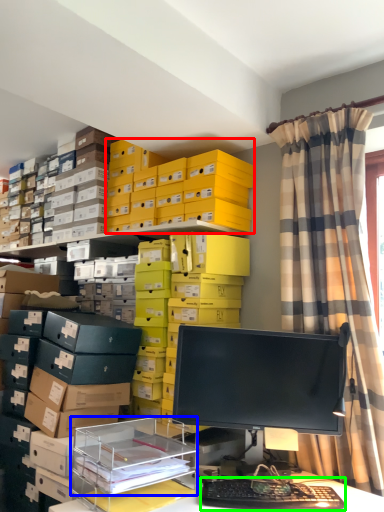
Question: Which object is the farthest from storage box (highlighted by a red box)? Choose among these: shelf (highlighted by a blue box) or computer keyboard (highlighted by a green box).

Choices:
 (A) shelf
 (B) computer keyboard

Answer: (B)